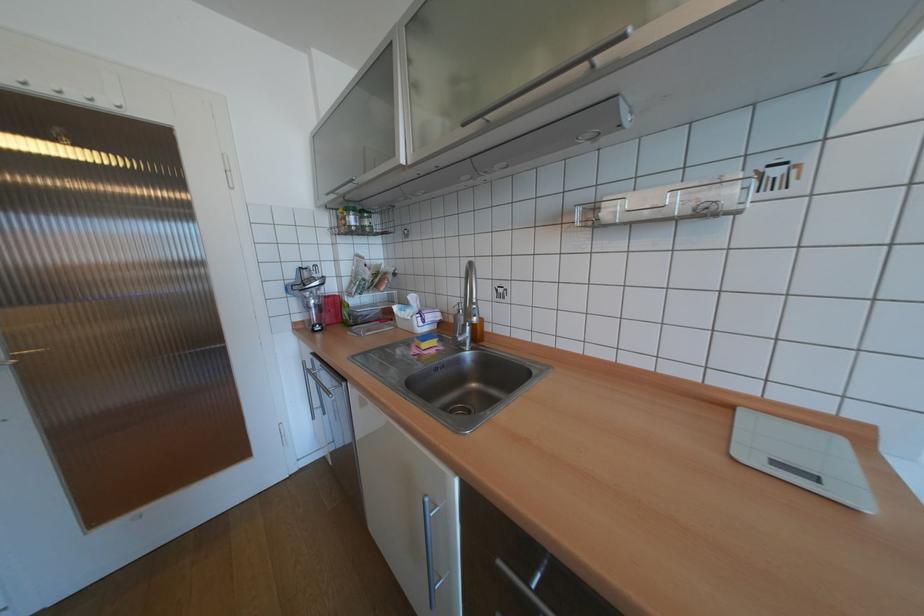
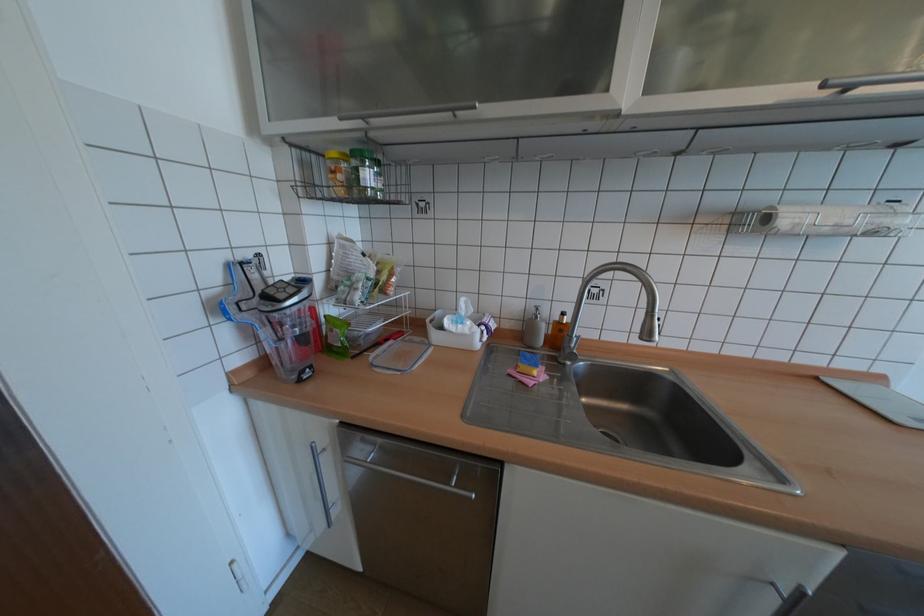
Where in the second image is the point corresponding to (353,222) from the first image?

(348, 177)